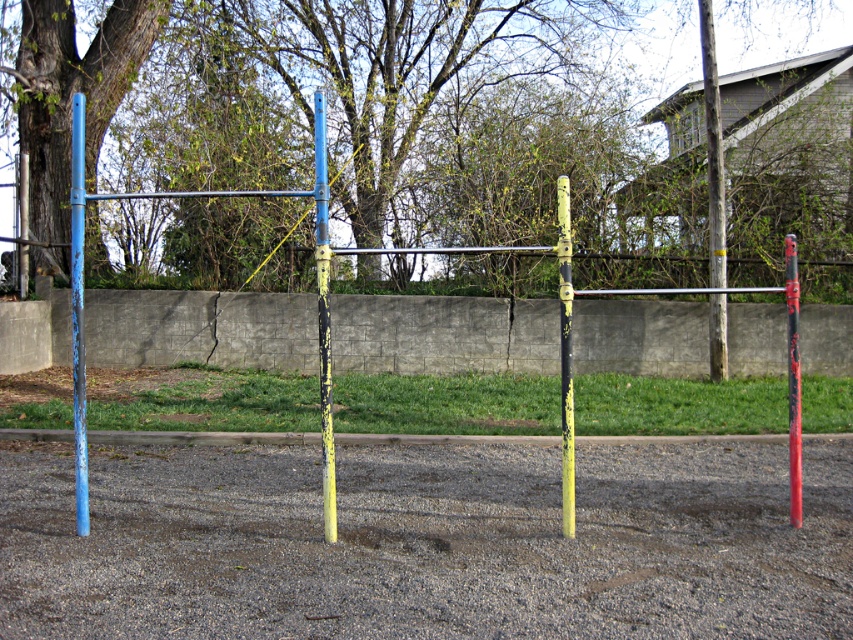
Question: Does brown rough tree at upper left appear on the left side of red glossy pole at center?

Choices:
 (A) yes
 (B) no

Answer: (A)

Question: Based on their relative distances, which object is nearer to the blue painted metal pole at left?

Choices:
 (A) brown rough tree at upper left
 (B) brushed metal pole at upper left
 (C) concrete wall at center

Answer: (B)

Question: Does concrete wall at center have a larger size compared to yellow painted pole at center?

Choices:
 (A) no
 (B) yes

Answer: (A)

Question: Which of the following is the farthest from the observer?

Choices:
 (A) (42, 113)
 (B) (608, 67)

Answer: (B)

Question: Which is farther from the concrete wall at center?

Choices:
 (A) yellow painted wood pole at center
 (B) brown rough tree at upper left
 (C) red glossy pole at center

Answer: (C)

Question: Is blue painted metal pole at left closer to the viewer compared to yellow painted pole at center?

Choices:
 (A) yes
 (B) no

Answer: (A)